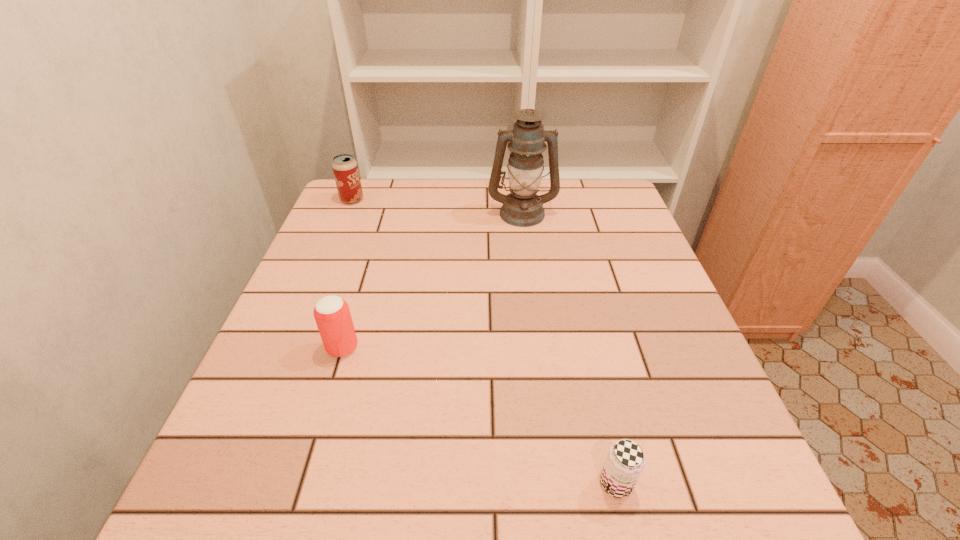
Where is `vacant space located 0.110m on the left of the nearest object`? vacant space located 0.110m on the left of the nearest object is located at coordinates (527, 483).

Locate an element on the screen. The image size is (960, 540). oil lamp present at the far edge is located at coordinates (522, 207).

Find the location of a particular element. beer can situated at the far edge is located at coordinates (345, 169).

Identify the location of object that is positioned at the near edge. The image size is (960, 540). (625, 461).

At what (x,y) coordinates should I click in order to perform the action: click on object that is at the far left corner. Please return your answer as a coordinate pair (x, y). The height and width of the screenshot is (540, 960). Looking at the image, I should click on (345, 169).

Identify the location of free space at the far edge of the desktop. (438, 199).

In the image, there is a desktop. What are the coordinates of `vacant space at the near edge` in the screenshot? It's located at (522, 513).

Locate an element on the screen. The width and height of the screenshot is (960, 540). vacant space at the left edge is located at coordinates (373, 255).

This screenshot has height=540, width=960. Find the location of `vacant space at the right edge`. vacant space at the right edge is located at coordinates (615, 316).

This screenshot has height=540, width=960. I want to click on free space at the far left corner, so click(394, 186).